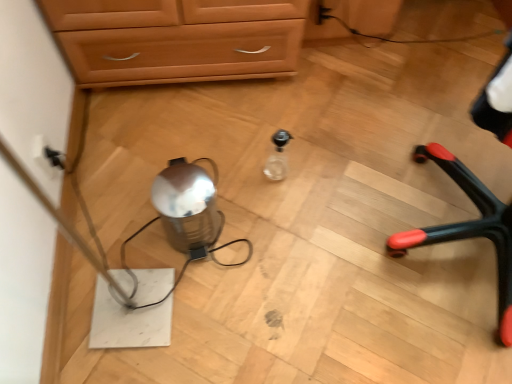
What is the approximate height of black plastic electric outlet at left?

black plastic electric outlet at left is 5.28 inches in height.

What do you see at coordinates (47, 157) in the screenshot?
I see `black plastic electric outlet at left` at bounding box center [47, 157].

This screenshot has height=384, width=512. I want to click on transparent glass bottle at center, so click(277, 156).

Is shiny metallic kettle at center at the back of black plastic chair legs at right?

That's right, black plastic chair legs at right is facing away from shiny metallic kettle at center.

Who is taller, black plastic chair legs at right or shiny metallic kettle at center?

Standing taller between the two is black plastic chair legs at right.

Would you say black plastic chair legs at right is a long distance from shiny metallic kettle at center?

black plastic chair legs at right is near shiny metallic kettle at center, not far away.

Locate an element on the screen. This screenshot has width=512, height=384. water on the left of black plastic chair legs at right is located at coordinates (187, 204).

Consider the image. Is black plastic electric outlet at left shorter than shiny metallic kettle at center?

Correct, black plastic electric outlet at left is not as tall as shiny metallic kettle at center.

Is black plastic electric outlet at left smaller than shiny metallic kettle at center?

Yes.

How distant is black plastic electric outlet at left from shiny metallic kettle at center?

The distance of black plastic electric outlet at left from shiny metallic kettle at center is 16.61 inches.

Is black plastic electric outlet at left in front of shiny metallic kettle at center?

That is False.

Measure the distance from black plastic chair legs at right to transparent glass bottle at center.

The distance of black plastic chair legs at right from transparent glass bottle at center is 21.62 inches.

Between black plastic chair legs at right and transparent glass bottle at center, which one appears on the right side from the viewer's perspective?

black plastic chair legs at right.

Does black plastic chair legs at right turn towards transparent glass bottle at center?

No, black plastic chair legs at right does not turn towards transparent glass bottle at center.

Does black plastic chair legs at right come in front of transparent glass bottle at center?

Yes, the depth of black plastic chair legs at right is less than that of transparent glass bottle at center.

Based on the photo, is black plastic chair legs at right with black plastic electric outlet at left?

No, black plastic chair legs at right is not with black plastic electric outlet at left.

From the image's perspective, relative to black plastic electric outlet at left, is black plastic chair legs at right above or below?

Based on their image positions, black plastic chair legs at right is located beneath black plastic electric outlet at left.

Considering the points (477, 122) and (48, 159), which point is behind, point (477, 122) or point (48, 159)?

The point (48, 159) is more distant.

Considering the positions of objects black plastic chair legs at right and black plastic electric outlet at left in the image provided, who is more to the left, black plastic chair legs at right or black plastic electric outlet at left?

From the viewer's perspective, black plastic electric outlet at left appears more on the left side.

Considering the sizes of objects transparent glass bottle at center and shiny metallic kettle at center in the image provided, who is smaller, transparent glass bottle at center or shiny metallic kettle at center?

With smaller size is transparent glass bottle at center.

The width and height of the screenshot is (512, 384). Identify the location of water lying in front of the transparent glass bottle at center. (187, 204).

Are transparent glass bottle at center and shiny metallic kettle at center located far from each other?

They are positioned close to each other.

Is point (279, 155) less distant than point (184, 222)?

No, (279, 155) is further to viewer.

Can you tell me how much shiny metallic kettle at center and transparent glass bottle at center differ in facing direction?

shiny metallic kettle at center and transparent glass bottle at center are facing 0.00202 degrees away from each other.

Considering the sizes of objects shiny metallic kettle at center and transparent glass bottle at center in the image provided, who is taller, shiny metallic kettle at center or transparent glass bottle at center?

shiny metallic kettle at center.

Would you say transparent glass bottle at center is part of shiny metallic kettle at center's contents?

That's incorrect, transparent glass bottle at center is not inside shiny metallic kettle at center.

How many degrees apart are the facing directions of shiny metallic kettle at center and black plastic chair legs at right?

The facing directions of shiny metallic kettle at center and black plastic chair legs at right are 24.8 degrees apart.

Between shiny metallic kettle at center and black plastic chair legs at right, which one has larger size?

black plastic chair legs at right.

Is shiny metallic kettle at center completely or partially outside of black plastic chair legs at right?

Yes.

Is shiny metallic kettle at center positioned in front of black plastic chair legs at right?

No, it is not.

You are a GUI agent. You are given a task and a screenshot of the screen. Output one action in this format:
    pyautogui.click(x=<x>, y=<y>)
    Task: Click on the water that appears behind the black plastic chair legs at right
    The height and width of the screenshot is (384, 512).
    Given the screenshot: What is the action you would take?
    click(187, 204)

Identify the location of electric outlet to the left of shiny metallic kettle at center. (47, 157).

Looking at the image, which one is located further to shiny metallic kettle at center, transparent glass bottle at center or black plastic electric outlet at left?

Based on the image, black plastic electric outlet at left appears to be further to shiny metallic kettle at center.

Based on their spatial positions, is shiny metallic kettle at center or transparent glass bottle at center closer to black plastic chair legs at right?

transparent glass bottle at center is closer to black plastic chair legs at right.

From the image, which object appears to be farther from black plastic electric outlet at left, shiny metallic kettle at center or black plastic chair legs at right?

Based on the image, black plastic chair legs at right appears to be further to black plastic electric outlet at left.

When comparing their distances from transparent glass bottle at center, does black plastic electric outlet at left or black plastic chair legs at right seem further?

black plastic electric outlet at left is further to transparent glass bottle at center.

Considering their positions, is black plastic chair legs at right positioned closer to black plastic electric outlet at left than transparent glass bottle at center?

transparent glass bottle at center is closer to black plastic electric outlet at left.

Based on their spatial positions, is shiny metallic kettle at center or black plastic electric outlet at left closer to transparent glass bottle at center?

Based on the image, shiny metallic kettle at center appears to be nearer to transparent glass bottle at center.

Which object lies further to the anchor point transparent glass bottle at center, black plastic chair legs at right or shiny metallic kettle at center?

black plastic chair legs at right is further to transparent glass bottle at center.

Based on their spatial positions, is black plastic electric outlet at left or transparent glass bottle at center further from shiny metallic kettle at center?

The object further to shiny metallic kettle at center is black plastic electric outlet at left.

You are a GUI agent. You are given a task and a screenshot of the screen. Output one action in this format:
    pyautogui.click(x=<x>, y=<y>)
    Task: Click on the bottle between shiny metallic kettle at center and black plastic chair legs at right from left to right
    The image size is (512, 384).
    Given the screenshot: What is the action you would take?
    pyautogui.click(x=277, y=156)

This screenshot has height=384, width=512. I want to click on water located between black plastic electric outlet at left and transparent glass bottle at center in the left-right direction, so click(x=187, y=204).

The width and height of the screenshot is (512, 384). I want to click on bottle between black plastic electric outlet at left and black plastic chair legs at right, so click(277, 156).

Identify the location of water situated between black plastic electric outlet at left and black plastic chair legs at right from left to right. (187, 204).